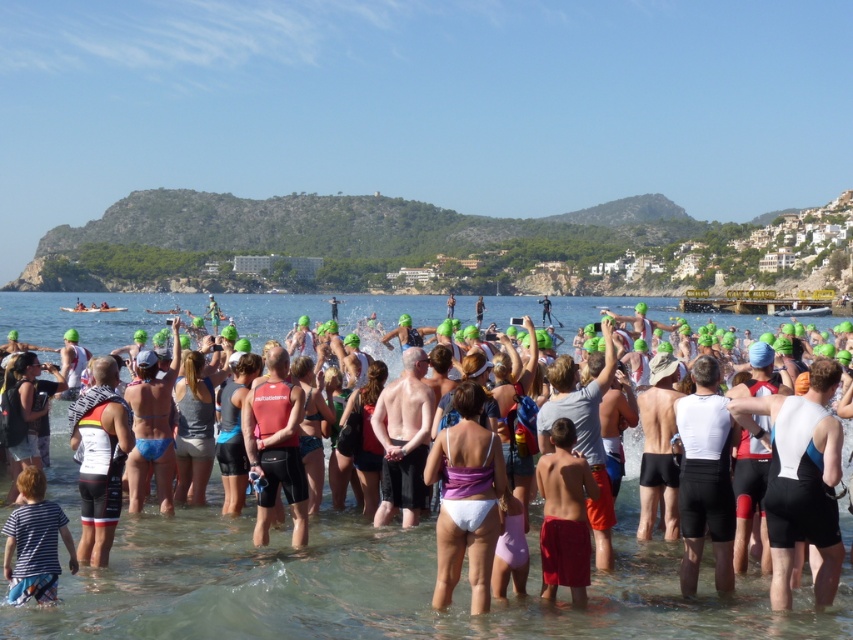
Question: Which point is farther to the camera?

Choices:
 (A) click(383, 394)
 (B) click(491, 465)
 (C) click(27, 468)
 (D) click(86, 403)

Answer: (A)

Question: Is clear water at center behind white matte wetsuit at center?

Choices:
 (A) yes
 (B) no

Answer: (B)

Question: Is clear water at center to the left of striped cotton shirt at lower left from the viewer's perspective?

Choices:
 (A) yes
 (B) no

Answer: (B)

Question: Does purple fabric bikini at center have a larger size compared to red cotton shorts at center?

Choices:
 (A) yes
 (B) no

Answer: (A)

Question: Which point appears farthest from the camera in this image?

Choices:
 (A) (405, 525)
 (B) (459, 492)

Answer: (A)

Question: Which object appears closest to the camera in this image?

Choices:
 (A) white matte wetsuit at center
 (B) clear water at center
 (C) skinny white man at center
 (D) red cotton shorts at center

Answer: (B)